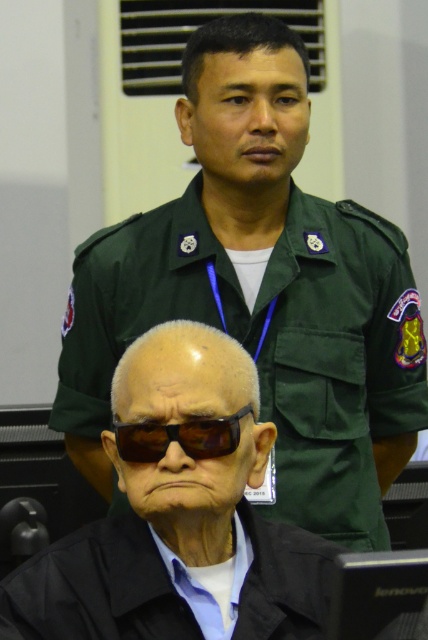
You are standing in the courtroom and need to reach a specific point marked at coordinates point (300, 598). If your maximum reach is 1.65 meters, can you touch that point?

The distance between you and point (300, 598) is 1.70 meters, which is slightly beyond your maximum reach of 1.65 meters. You cannot touch that point.

You are an optician assessing the items in the image. You need to determine which of the two items, the black matte sunglasses at lower center or the black plastic goggles at center, requires a larger storage container. Which one do you choose?

The black matte sunglasses at lower center requires a larger storage container because it is bigger than the black plastic goggles at center.

You are a security officer in the courtroom. You need to determine if the green fabric uniform at upper center can fully cover the black plastic goggles at center without overlapping. Based on their sizes, what is your conclusion?

The green fabric uniform at upper center is bigger than the black plastic goggles at center, so it can fully cover the black plastic goggles at center without overlapping.